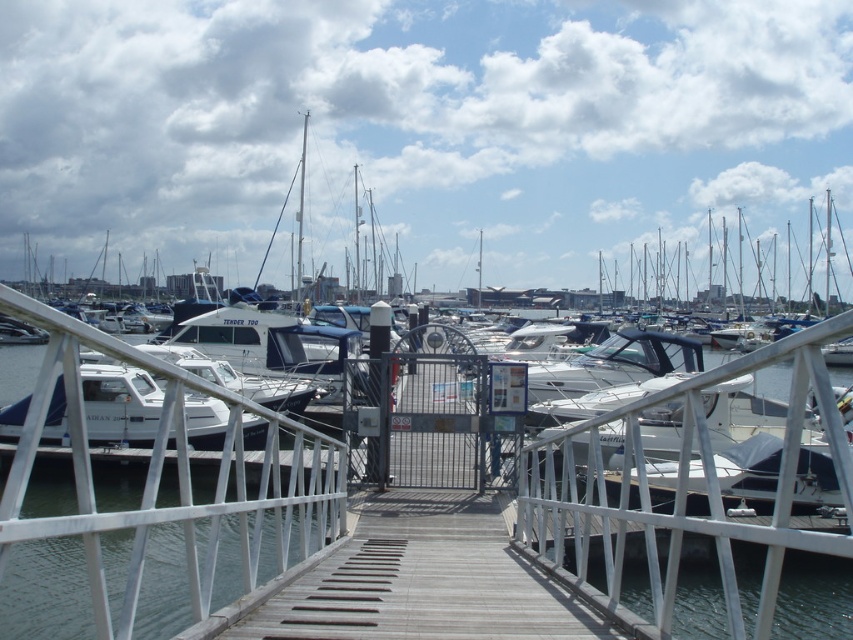
Between clear water at center and white matte boat at center, which one has more height?

With more height is white matte boat at center.

Can you confirm if clear water at center is shorter than white matte boat at center?

Yes, clear water at center is shorter than white matte boat at center.

Identify the location of clear water at center. The image size is (853, 640). (161, 477).

The image size is (853, 640). Identify the location of clear water at center. (161, 477).